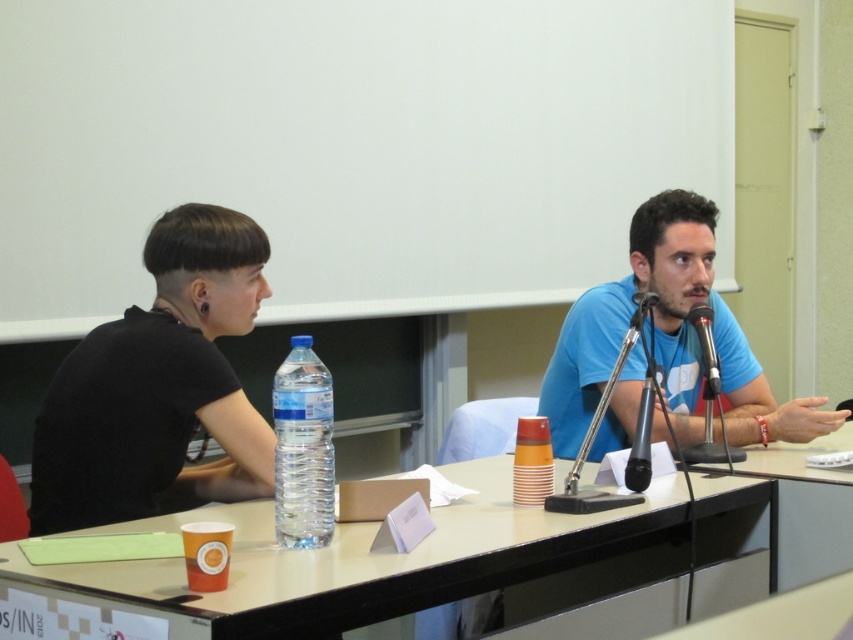
You are organizing a small event and need to choose between the black glossy microphone at center and the black metallic microphone at center for a speaker who prefers a wider grip. Which microphone should they choose?

The black metallic microphone at center has a greater width compared to the black glossy microphone at center, so the speaker should choose the black metallic microphone at center for a wider grip.

You are a sound technician setting up for a presentation. You need to ensure the microphone closest to the speaker is the one with the best audio quality. Which microphone should you choose between the black glossy microphone at center and the black metallic microphone at center?

The black glossy microphone at center is in front of the black metallic microphone at center, so the black glossy microphone at center is closer to the speaker and should be chosen for better audio quality.

Consider the image. You are a photographer standing 5 feet away from the table. You want to take a photo of both the black matte shirt at left and the blue matte shirt at center in the same frame. Can you do this without moving your position?

The black matte shirt at left and blue matte shirt at center are 3.59 feet apart. Since you are 5 feet away from the table, the distance between them is within your camera frame, so yes, you can capture both in the same photo without moving.